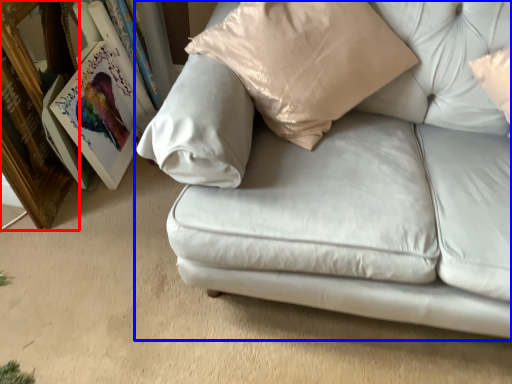
Question: Which of the following is the closest to the observer, picture frame (highlighted by a red box) or studio couch (highlighted by a blue box)?

Choices:
 (A) picture frame
 (B) studio couch

Answer: (B)